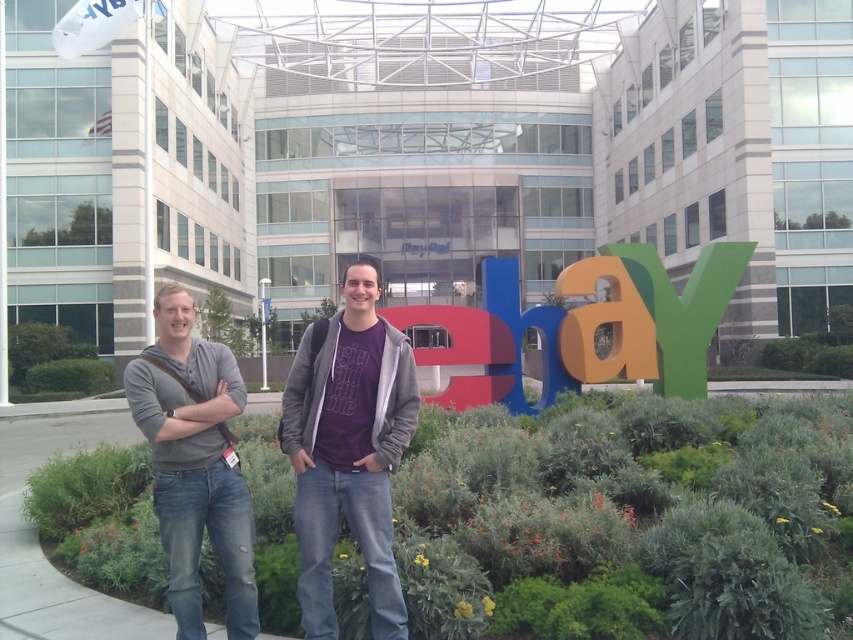
What do you see at coordinates (349, 451) in the screenshot? I see `gray cotton hoodie at center` at bounding box center [349, 451].

Locate an element on the screen. Image resolution: width=853 pixels, height=640 pixels. gray cotton hoodie at center is located at coordinates (349, 451).

The image size is (853, 640). Identify the location of gray cotton hoodie at center. (349, 451).

In order to click on gray cotton hoodie at center in this screenshot , I will do tap(349, 451).

Who is lower down, purple matte shirt at center or gray cotton hoodie at left?

purple matte shirt at center is below.

The width and height of the screenshot is (853, 640). I want to click on purple matte shirt at center, so click(349, 451).

You are a GUI agent. You are given a task and a screenshot of the screen. Output one action in this format:
    pyautogui.click(x=<x>, y=<y>)
    Task: Click on the purple matte shirt at center
    This screenshot has height=640, width=853.
    Given the screenshot: What is the action you would take?
    pyautogui.click(x=349, y=451)

Is gray cotton hoodie at center smaller than orange matte letter at center?

Indeed, gray cotton hoodie at center has a smaller size compared to orange matte letter at center.

Is gray cotton hoodie at center wider than orange matte letter at center?

Indeed, gray cotton hoodie at center has a greater width compared to orange matte letter at center.

Where is `gray cotton hoodie at center`? The image size is (853, 640). gray cotton hoodie at center is located at coordinates (349, 451).

Identify the location of gray cotton hoodie at center. Image resolution: width=853 pixels, height=640 pixels. (349, 451).